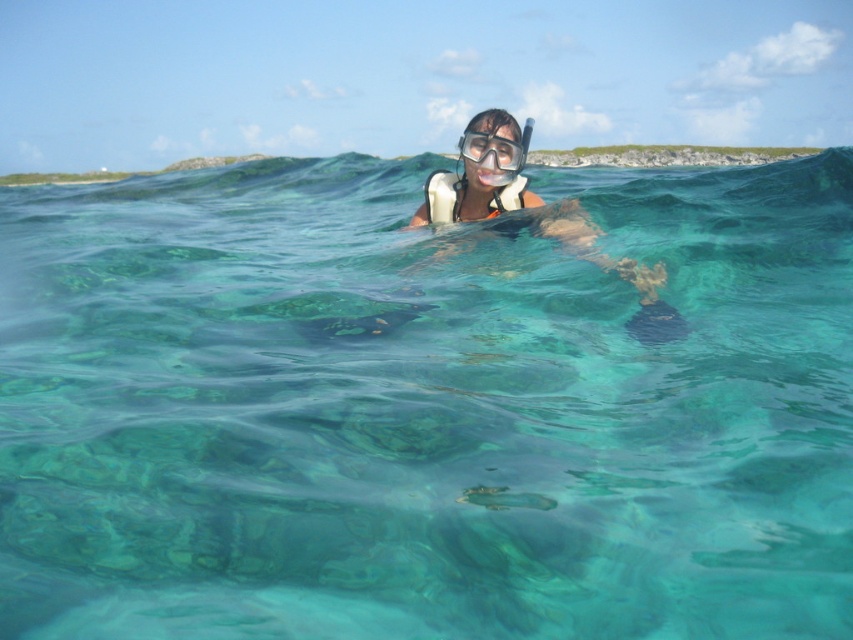
Is clear plastic snorkel at center to the left of clear plastic goggles at center from the viewer's perspective?

In fact, clear plastic snorkel at center is to the right of clear plastic goggles at center.

Does clear plastic snorkel at center have a lesser width compared to clear plastic goggles at center?

No, clear plastic snorkel at center is not thinner than clear plastic goggles at center.

Find the location of a particular element. This screenshot has height=640, width=853. clear plastic snorkel at center is located at coordinates (480, 173).

This screenshot has height=640, width=853. I want to click on clear plastic snorkel at center, so click(x=480, y=173).